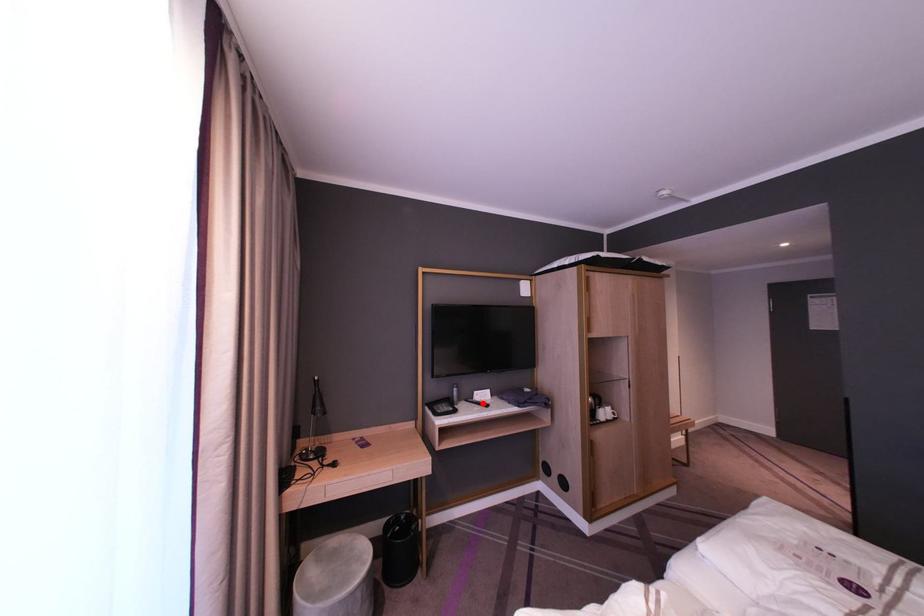
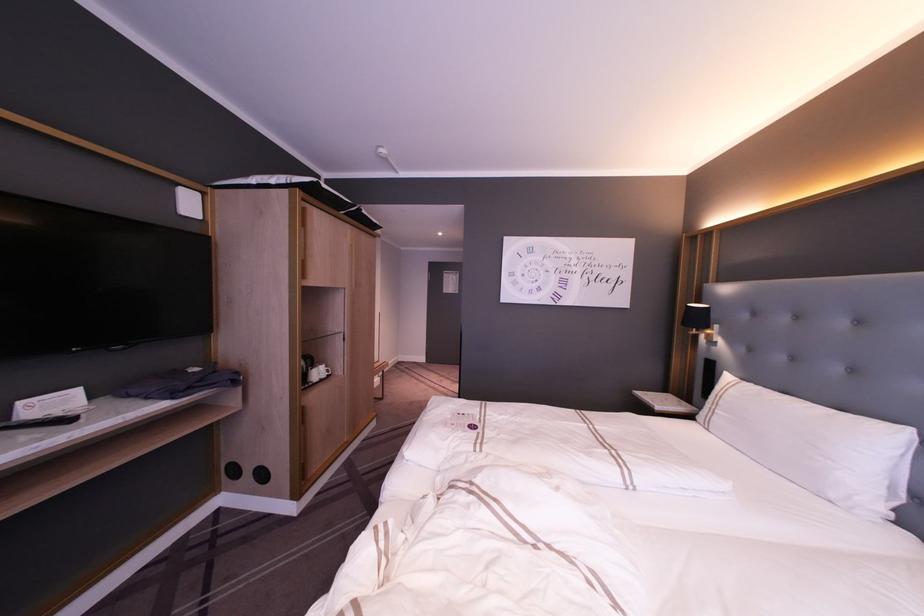
The point at the highlighted location is marked in the first image. Where is the corresponding point in the second image?

(59, 419)